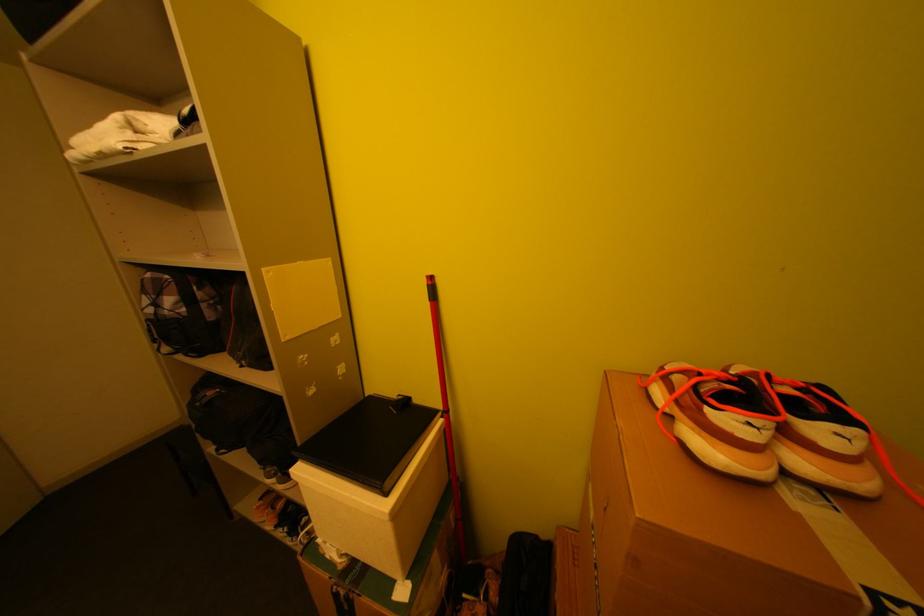
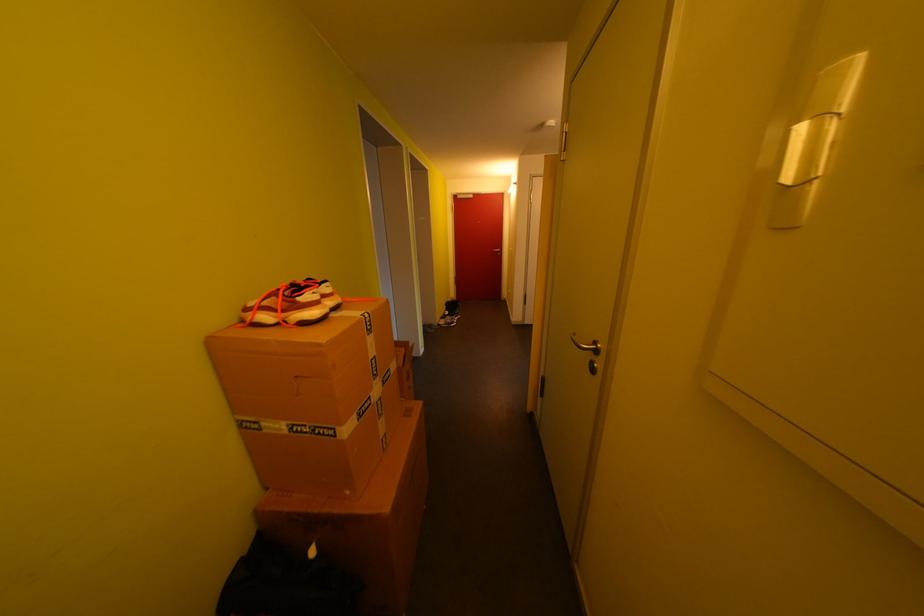
The first image is from the beginning of the video and the second image is from the end. How did the camera likely rotate when shooting the video?

The camera's rotation is toward right-down.